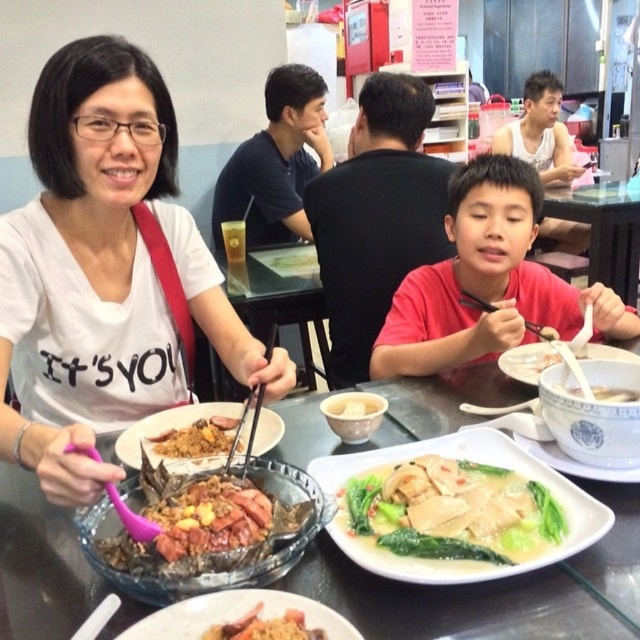
Question: Can you confirm if translucent glass table at center is wider than transparent plastic table at center?

Choices:
 (A) no
 (B) yes

Answer: (B)

Question: Which point appears farthest from the camera in this image?

Choices:
 (A) 577,451
 (B) 54,492
 (C) 448,316
 (D) 307,636

Answer: (C)

Question: Can you confirm if white matte t-shirt at upper left is positioned to the right of brown matte rice at lower center?

Choices:
 (A) no
 (B) yes

Answer: (A)

Question: Observing the image, what is the correct spatial positioning of red matte shirt at center in reference to transparent plastic table at center?

Choices:
 (A) above
 (B) below

Answer: (B)

Question: Based on their relative distances, which object is farther from the brown matte rice at lower center?

Choices:
 (A) white matte bowl at center
 (B) white ceramic bowl at center

Answer: (B)

Question: Which point is closer to the camera?

Choices:
 (A) (604, 426)
 (B) (305, 445)
 (C) (624, 396)

Answer: (A)